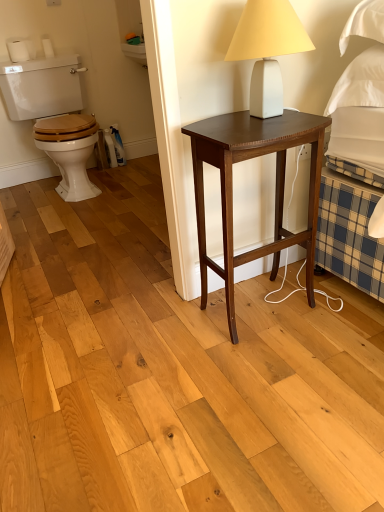
Locate an element on the screen. free space in front of wooden at left is located at coordinates (x=53, y=226).